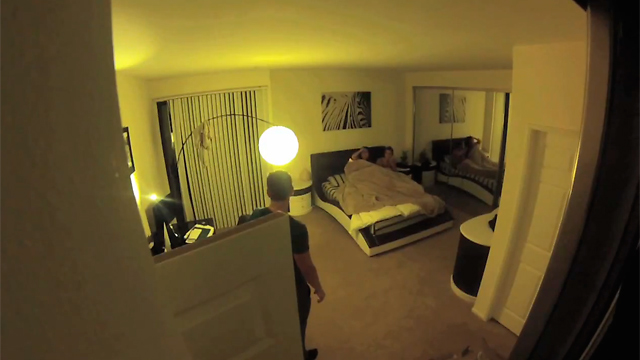
Where is `wall`? wall is located at coordinates (144, 136), (291, 114), (397, 104).